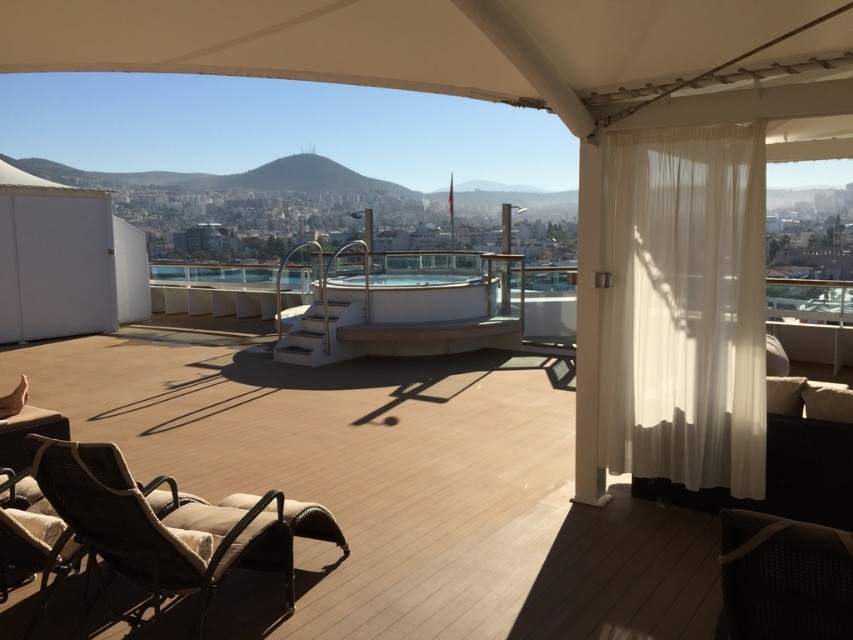
Can you confirm if white sheer curtain at right is wider than brown woven armchair at lower left?

No, white sheer curtain at right is not wider than brown woven armchair at lower left.

Between point (619, 252) and point (227, 541), which one is positioned in front?

Point (227, 541) is more forward.

In order to click on white sheer curtain at right in this screenshot , I will do `click(683, 307)`.

Is white sheer curtain at right taller than dark brown woven armchair at lower right?

Yes, white sheer curtain at right is taller than dark brown woven armchair at lower right.

Does white sheer curtain at right have a greater width compared to dark brown woven armchair at lower right?

Yes.

The image size is (853, 640). Identify the location of white sheer curtain at right. (683, 307).

You are a GUI agent. You are given a task and a screenshot of the screen. Output one action in this format:
    pyautogui.click(x=<x>, y=<y>)
    Task: Click on the white sheer curtain at right
    The width and height of the screenshot is (853, 640).
    Given the screenshot: What is the action you would take?
    pyautogui.click(x=683, y=307)

Is point (148, 582) in front of point (778, 561)?

No.

Does brown woven armchair at lower left appear under dark brown woven armchair at lower right?

Yes.

What do you see at coordinates (167, 524) in the screenshot? This screenshot has height=640, width=853. I see `brown woven armchair at lower left` at bounding box center [167, 524].

The height and width of the screenshot is (640, 853). In order to click on brown woven armchair at lower left in this screenshot , I will do `click(167, 524)`.